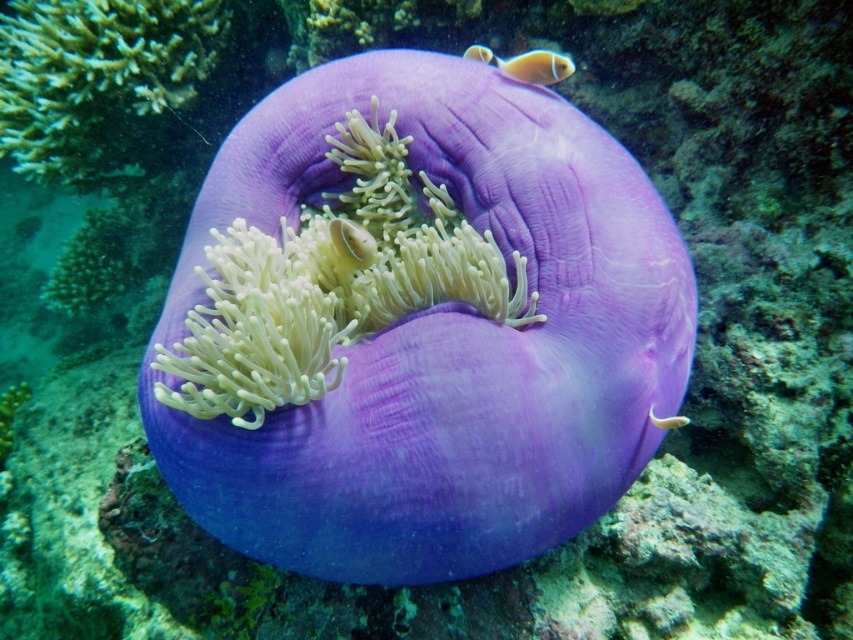
Question: From the image, what is the correct spatial relationship of purple soft coral at center in relation to orange matte fish at upper right?

Choices:
 (A) above
 (B) below

Answer: (B)

Question: Estimate the real-world distances between objects in this image. Which object is farther from the green coral at upper left?

Choices:
 (A) orange matte fish at upper right
 (B) translucent white fish at center

Answer: (B)

Question: Among these objects, which one is nearest to the camera?

Choices:
 (A) purple soft coral at center
 (B) green coral at upper left

Answer: (A)

Question: Does purple soft coral at center lie in front of translucent white fish at center?

Choices:
 (A) yes
 (B) no

Answer: (A)

Question: Is the position of purple soft coral at center more distant than that of translucent white fish at center?

Choices:
 (A) no
 (B) yes

Answer: (A)

Question: Which object appears farthest from the camera in this image?

Choices:
 (A) purple soft coral at center
 (B) orange matte fish at upper right
 (C) green coral at upper left

Answer: (C)